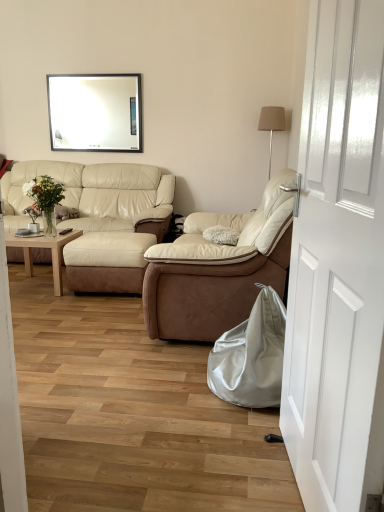
Image resolution: width=384 pixels, height=512 pixels. What are the coordinates of `vacant area in front of beige leather recliner at center, arranged as the 2th studio couch when viewed from the back` in the screenshot? It's located at tap(143, 407).